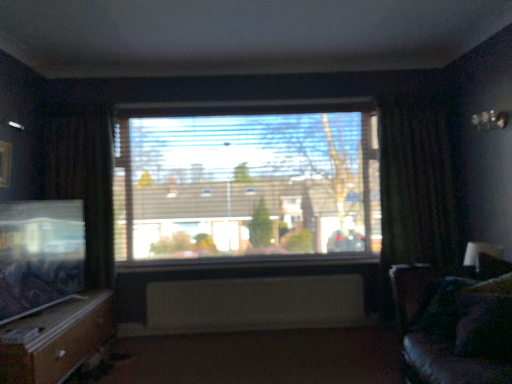
Question: From a real-world perspective, relative to dark fabric curtain at right, the 2th curtain in the left-to-right sequence, is wooden drawer at lower left vertically above or below?

Choices:
 (A) above
 (B) below

Answer: (B)

Question: Is wooden drawer at lower left inside the boundaries of dark fabric curtain at right, the 2th curtain in the left-to-right sequence, or outside?

Choices:
 (A) inside
 (B) outside

Answer: (B)

Question: Which is nearer to the velvet dark blue pillow at lower right?

Choices:
 (A) dark fabric curtain at right, the 2th curtain in the left-to-right sequence
 (B) white painted wood at center
 (C) white textured radiator at center
 (D) velvet dark brown couch at right
 (E) transparent glass window at center

Answer: (D)

Question: Which is nearer to the wooden frame at left?

Choices:
 (A) velvet dark brown couch at right
 (B) dark fabric curtain at right, the 2th curtain in the left-to-right sequence
 (C) transparent glass window at center
 (D) velvet dark blue pillow at lower right
 (E) dark brown fabric curtain at left, which is the 1th curtain from left to right

Answer: (E)